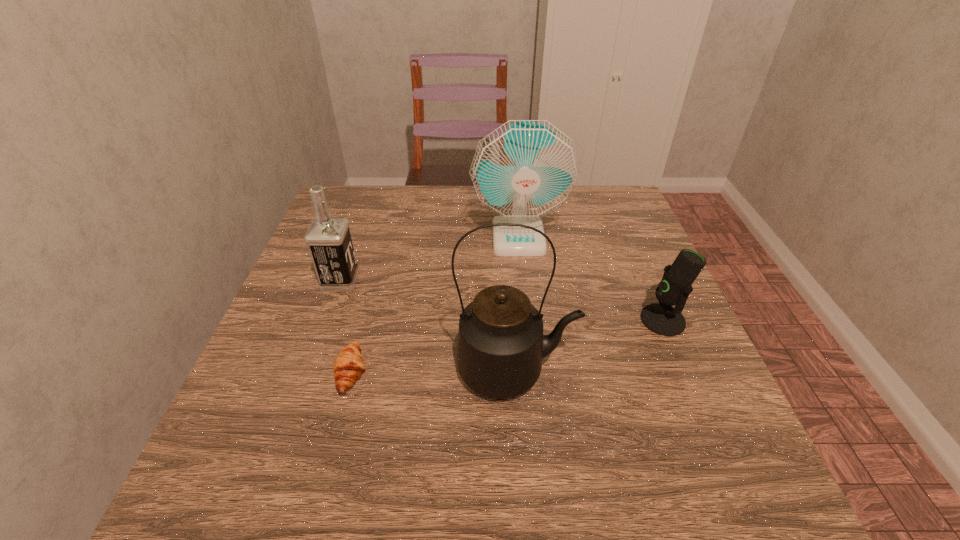
Find the location of `free space between the third shortest object and the fourth object from right to left`. free space between the third shortest object and the fourth object from right to left is located at coordinates (346, 327).

Where is `free space between the kettle and the second shortest object`? The image size is (960, 540). free space between the kettle and the second shortest object is located at coordinates (589, 345).

Where is `free space between the fourth nearest object and the farthest object`? This screenshot has width=960, height=540. free space between the fourth nearest object and the farthest object is located at coordinates (429, 259).

Find the location of `vacant area that lies between the fan and the third farthest object`. vacant area that lies between the fan and the third farthest object is located at coordinates (590, 279).

Image resolution: width=960 pixels, height=540 pixels. In order to click on object that is the second closest to the farthest object in this screenshot , I will do `click(328, 238)`.

Select which object is the closest to the microphone. Please provide its 2D coordinates. Your answer should be formatted as a tuple, i.e. [(x, y)], where the tuple contains the x and y coordinates of a point satisfying the conditions above.

[(501, 344)]

This screenshot has height=540, width=960. Find the location of `vacant area that satisfies the following two spatial constraints: 1. on the front label of the vodka; 2. on the right side of the microphone`. vacant area that satisfies the following two spatial constraints: 1. on the front label of the vodka; 2. on the right side of the microphone is located at coordinates (326, 320).

In order to click on vacant point that satisfies the following two spatial constraints: 1. in front of the third nearest object to face the airflow; 2. on the left side of the farthest object in this screenshot , I will do `click(527, 320)`.

This screenshot has width=960, height=540. I want to click on vacant point that satisfies the following two spatial constraints: 1. in front of the farthest object to face the airflow; 2. spout on the kettle, so click(533, 370).

Locate an element on the screen. Image resolution: width=960 pixels, height=540 pixels. vacant position in the image that satisfies the following two spatial constraints: 1. on the front label of the fourth tallest object; 2. on the right side of the vodka is located at coordinates (326, 320).